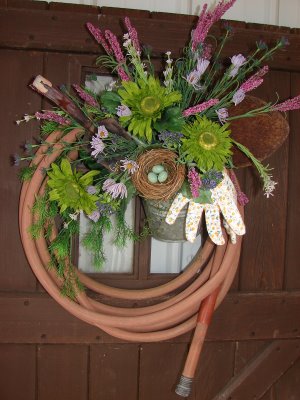
Identify the location of 1 metal pot. The image size is (300, 400). (173, 227).